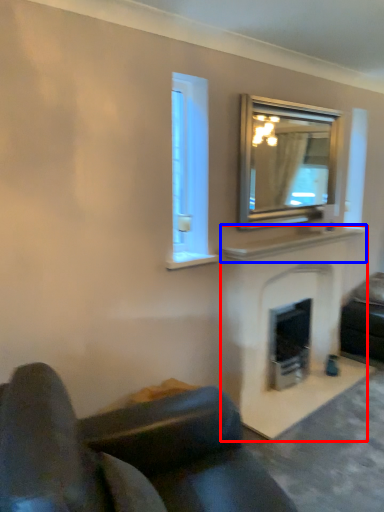
Question: Which object is further to the camera taking this photo, fireplace (highlighted by a red box) or mantle (highlighted by a blue box)?

Choices:
 (A) fireplace
 (B) mantle

Answer: (B)